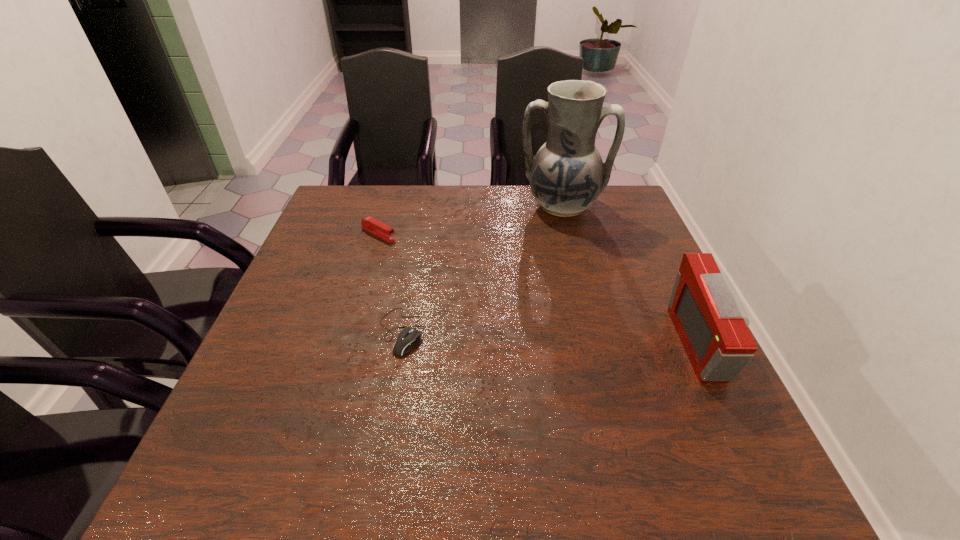
The width and height of the screenshot is (960, 540). In order to click on vacant space located 0.090m on the front-facing side of the third object from left to right in this screenshot , I will do `click(554, 245)`.

This screenshot has width=960, height=540. Identify the location of free space located on the front-facing side of the third object from left to right. (552, 256).

Where is `vacant point located 0.190m on the front-facing side of the stapler`? vacant point located 0.190m on the front-facing side of the stapler is located at coordinates (444, 267).

I want to click on free space located 0.400m on the front-facing side of the stapler, so click(513, 301).

Where is `vacant position located on the front-facing side of the stapler`? The width and height of the screenshot is (960, 540). vacant position located on the front-facing side of the stapler is located at coordinates (502, 296).

I want to click on pitcher present at the far edge, so click(567, 175).

The height and width of the screenshot is (540, 960). Identify the location of stapler present at the far edge. (370, 224).

At what (x,y) coordinates should I click in order to perform the action: click on object that is at the left edge. Please return your answer as a coordinate pair (x, y). Looking at the image, I should click on (370, 224).

Locate an element on the screen. camera that is at the right edge is located at coordinates (710, 320).

At what (x,y) coordinates should I click in order to perform the action: click on pitcher located at the right edge. Please return your answer as a coordinate pair (x, y). The image size is (960, 540). Looking at the image, I should click on (x=567, y=175).